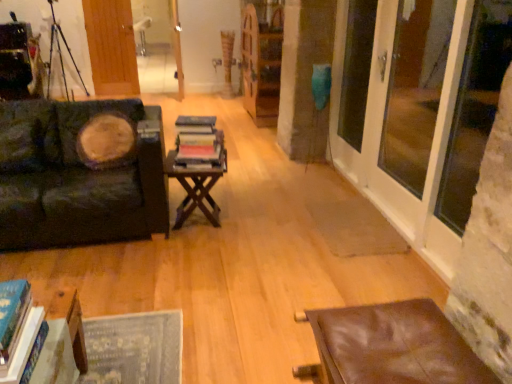
I want to click on white glossy door at center, so click(177, 47).

The width and height of the screenshot is (512, 384). Describe the element at coordinates (69, 320) in the screenshot. I see `wooden table at lower left, the first table viewed from the left` at that location.

Find the location of a particular element. The image size is (512, 384). wooden door at upper left is located at coordinates (111, 46).

What is the approximate width of velvet dark green couch at left?

37.69 inches.

This screenshot has width=512, height=384. What do you see at coordinates (81, 173) in the screenshot?
I see `velvet dark green couch at left` at bounding box center [81, 173].

This screenshot has width=512, height=384. Identify the location of white glossy door at center. (177, 47).

In the scene shown: From the image's perspective, is velvet dark green couch at left above transparent glass door at right, the 2th window screen positioned from the front?

No.

Starting from the velvet dark green couch at left, which window screen is the 1st one in front? Please provide its 2D coordinates.

[(415, 89)]

Do you think velvet dark green couch at left is within transparent glass door at right, the 2th window screen positioned from the front, or outside of it?

velvet dark green couch at left cannot be found inside transparent glass door at right, the 2th window screen positioned from the front.

How many degrees apart are the facing directions of velvet dark green couch at left and transparent glass door at right, the 2th window screen positioned from the front?

The angle between the facing direction of velvet dark green couch at left and the facing direction of transparent glass door at right, the 2th window screen positioned from the front, is 91.5 degrees.

How far apart are metallic tripod at upper left and wooden bookcase at center?

metallic tripod at upper left is 2.62 meters from wooden bookcase at center.

Could you tell me if metallic tripod at upper left is turned towards wooden bookcase at center?

No, metallic tripod at upper left is not facing towards wooden bookcase at center.

Is there a large distance between metallic tripod at upper left and wooden bookcase at center?

Indeed, metallic tripod at upper left is not near wooden bookcase at center.

Can we say metallic tripod at upper left lies outside wooden bookcase at center?

Yes, metallic tripod at upper left is located beyond the bounds of wooden bookcase at center.

Locate an element on the screen. book on the left of transparent glass door at right, marked as the 3th window screen in a back-to-front arrangement is located at coordinates (199, 143).

From a real-world perspective, is transparent glass door at right, marked as the 3th window screen in a back-to-front arrangement, over hardcover books at center?

Indeed, from a real-world perspective, transparent glass door at right, marked as the 3th window screen in a back-to-front arrangement, stands above hardcover books at center.

Who is shorter, transparent glass door at right, marked as the 3th window screen in a back-to-front arrangement, or hardcover books at center?

hardcover books at center.

Consider the image. Is wooden table at lower left, placed as the third table when sorted from right to left, to the right of metallic tripod at upper left from the viewer's perspective?

Indeed, wooden table at lower left, placed as the third table when sorted from right to left, is positioned on the right side of metallic tripod at upper left.

From their relative heights in the image, would you say wooden table at lower left, the 1th table in the front-to-back sequence, is taller or shorter than metallic tripod at upper left?

wooden table at lower left, the 1th table in the front-to-back sequence, is shorter than metallic tripod at upper left.

Image resolution: width=512 pixels, height=384 pixels. What are the coordinates of `table that is the 1st one when counting rightward from the metallic tripod at upper left` in the screenshot? It's located at (69, 320).

Is brown leather table at lower right, which is the first table in right-to-left order, located outside velvet dark green couch at left?

Absolutely, brown leather table at lower right, which is the first table in right-to-left order, is external to velvet dark green couch at left.

From a real-world perspective, is brown leather table at lower right, which is the first table in right-to-left order, physically located above or below velvet dark green couch at left?

brown leather table at lower right, which is the first table in right-to-left order, is below velvet dark green couch at left.

From the image's perspective, is brown leather table at lower right, the 1th table positioned from the bottom, on top of velvet dark green couch at left?

Incorrect, from the image's perspective, brown leather table at lower right, the 1th table positioned from the bottom, is lower than velvet dark green couch at left.

Considering the sizes of objects brown leather table at lower right, the second table when ordered from front to back, and velvet dark green couch at left in the image provided, who is wider, brown leather table at lower right, the second table when ordered from front to back, or velvet dark green couch at left?

Wider between the two is velvet dark green couch at left.

Based on the photo, is wooden table at lower left, the second table positioned from the top, positioned with its back to wooden door at upper left?

No, wooden door at upper left is not at the back of wooden table at lower left, the second table positioned from the top.

From a real-world perspective, is wooden table at lower left, the second table positioned from the top, physically below wooden door at upper left?

Yes, from a real-world perspective, wooden table at lower left, the second table positioned from the top, is beneath wooden door at upper left.

What's the angular difference between wooden table at lower left, which appears as the 3th table when viewed from the back, and wooden door at upper left's facing directions?

They differ by 178 degrees in their facing directions.

Looking at the image, does wooden table at lower left, the second table positioned from the top, seem bigger or smaller compared to wooden door at upper left?

In the image, wooden table at lower left, the second table positioned from the top, appears to be smaller than wooden door at upper left.

Can you tell me how much metallic tripod at upper left and velvet dark green couch at left differ in facing direction?

2.13 degrees.

Where is `tripod positioned vertically above the velvet dark green couch at left (from a real-world perspective)`? tripod positioned vertically above the velvet dark green couch at left (from a real-world perspective) is located at coordinates (60, 54).

Between point (52, 39) and point (67, 116), which one is positioned in front?

The point (67, 116) is in front.

From the image's perspective, is metallic tripod at upper left below velvet dark green couch at left?

Actually, metallic tripod at upper left appears above velvet dark green couch at left in the image.

You are a GUI agent. You are given a task and a screenshot of the screen. Output one action in this format:
    pyautogui.click(x=<x>, y=<y>)
    Task: Click on the 2nd window screen above the velvet dark green couch at left (from the image's perspective)
    This screenshot has width=512, height=384.
    Given the screenshot: What is the action you would take?
    pyautogui.click(x=415, y=89)

Locate an element on the screen. bookcase beneath the metallic tripod at upper left (from a real-world perspective) is located at coordinates (261, 64).

Looking at the image, which one is located further to transparent glass door at right, which ranks as the third window screen in front-to-back order, wooden door at upper left or white glossy door at center?

Among the two, white glossy door at center is located further to transparent glass door at right, which ranks as the third window screen in front-to-back order.

Estimate the real-world distances between objects in this image. Which object is further from hardcover books at center, brown wooden table at center, arranged as the first table when viewed from the back, or transparent glass door at right, which is the first window screen from front to back?

The object further to hardcover books at center is transparent glass door at right, which is the first window screen from front to back.

Looking at the image, which one is located further to hardcover books at center, metallic tripod at upper left or transparent glass door at right, the 2th window screen positioned from the front?

Among the two, metallic tripod at upper left is located further to hardcover books at center.

Considering their positions, is transparent glass door at right, which ranks as the third window screen in front-to-back order, positioned closer to hardcover books at center than brown wooden table at center, which appears as the first table when viewed from the top?

The object closer to hardcover books at center is brown wooden table at center, which appears as the first table when viewed from the top.

Based on their spatial positions, is brown leather table at lower right, the second table when ordered from front to back, or transparent glass door at right, which ranks as the third window screen in front-to-back order, closer to transparent glass door at right, the 2th window screen positioned from the back?

transparent glass door at right, which ranks as the third window screen in front-to-back order, is positioned closer to the anchor transparent glass door at right, the 2th window screen positioned from the back.

Which object lies further to the anchor point wooden table at lower left, the first table viewed from the left, transparent glass door at right, which ranks as the third window screen in front-to-back order, or metallic tripod at upper left?

Based on the image, metallic tripod at upper left appears to be further to wooden table at lower left, the first table viewed from the left.

When comparing their distances from transparent glass door at right, which is the first window screen from front to back, does brown wooden table at center, arranged as the first table when viewed from the back, or wooden bookcase at center seem closer?

brown wooden table at center, arranged as the first table when viewed from the back, is closer to transparent glass door at right, which is the first window screen from front to back.

Which object lies nearer to the anchor point wooden bookcase at center, brown leather table at lower right, which is the first table in right-to-left order, or velvet dark green couch at left?

Based on the image, velvet dark green couch at left appears to be nearer to wooden bookcase at center.

Locate an element on the screen. The width and height of the screenshot is (512, 384). book positioned between transparent glass door at right, the 2th window screen positioned from the back, and metallic tripod at upper left from near to far is located at coordinates (199, 143).

The height and width of the screenshot is (384, 512). In order to click on door between velvet dark green couch at left and wooden door at upper left from front to back in this screenshot , I will do `click(177, 47)`.

Find the location of a particular element. The image size is (512, 384). window screen between wooden table at lower left, the first table viewed from the left, and transparent glass door at right, the 2th window screen positioned from the back is located at coordinates (356, 70).

Where is `table between transparent glass door at right, the 2th window screen positioned from the front, and white glossy door at center in the front-back direction`? The image size is (512, 384). table between transparent glass door at right, the 2th window screen positioned from the front, and white glossy door at center in the front-back direction is located at coordinates (197, 183).